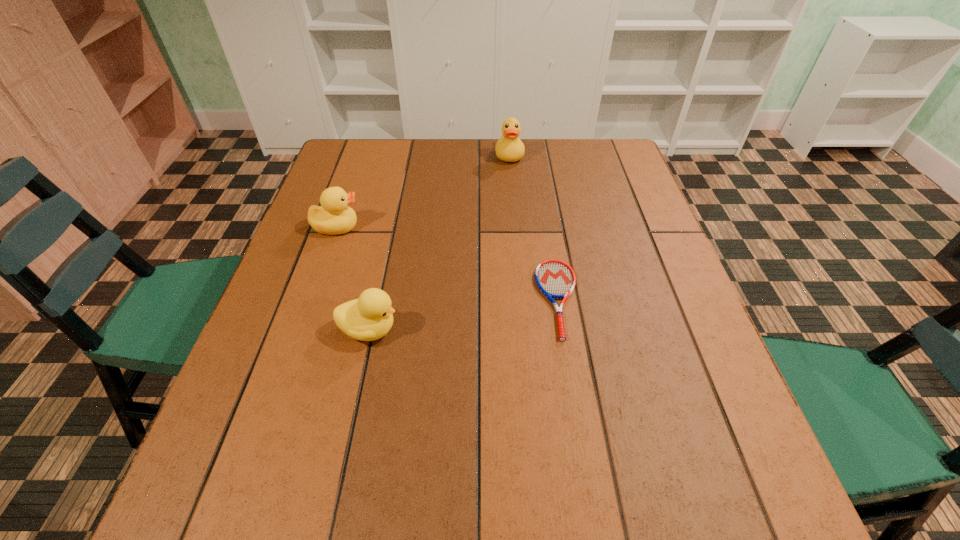
Locate an element on the screen. This screenshot has height=540, width=960. the rightmost duck is located at coordinates (509, 148).

Find the location of a particular element. The image size is (960, 540). the farthest object is located at coordinates (509, 148).

At what (x,y) coordinates should I click in order to perform the action: click on the leftmost object. Please return your answer as a coordinate pair (x, y). Looking at the image, I should click on (334, 216).

This screenshot has width=960, height=540. What are the coordinates of `the second farthest object` in the screenshot? It's located at (334, 216).

You are a GUI agent. You are given a task and a screenshot of the screen. Output one action in this format:
    pyautogui.click(x=<x>, y=<y>)
    Task: Click on the third object from right to left
    This screenshot has height=540, width=960.
    Given the screenshot: What is the action you would take?
    pyautogui.click(x=370, y=317)

Locate an element on the screen. the second duck from right to left is located at coordinates (370, 317).

In order to click on the shortest object in this screenshot , I will do `click(556, 279)`.

Where is `vacant area situated at the beak of the farthest duck`? Image resolution: width=960 pixels, height=540 pixels. vacant area situated at the beak of the farthest duck is located at coordinates (511, 176).

The width and height of the screenshot is (960, 540). Identify the location of free space located at the beak of the leftmost object. (412, 227).

The image size is (960, 540). I want to click on vacant region located 0.370m on the front-facing side of the second duck from right to left, so click(580, 330).